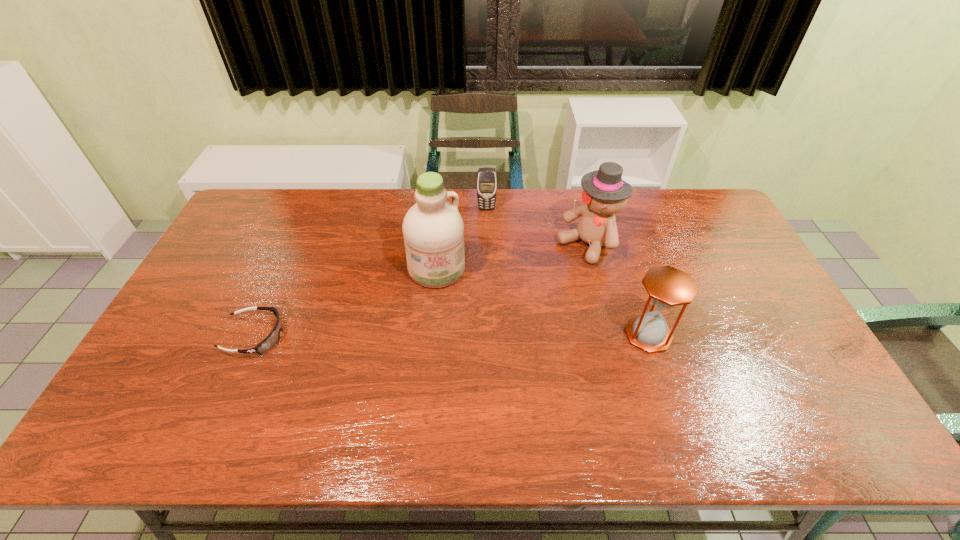
The height and width of the screenshot is (540, 960). In order to click on vacant region located 0.340m on the front face of the farthest object in this screenshot , I will do `click(490, 279)`.

The image size is (960, 540). I want to click on vacant area situated on the front face of the farthest object, so click(489, 255).

What are the coordinates of `vacant space located 0.060m on the front face of the farthest object` in the screenshot? It's located at (488, 222).

Find the location of `free space located on the front label of the tallest object`. free space located on the front label of the tallest object is located at coordinates point(450,314).

In order to click on vacant area located on the front label of the tallest object in this screenshot , I will do `click(473, 389)`.

The width and height of the screenshot is (960, 540). I want to click on free spot located 0.060m on the front label of the tallest object, so click(447, 303).

The image size is (960, 540). In order to click on vacant space situated 0.380m on the front-facing side of the fourth shortest object in this screenshot , I will do `click(484, 325)`.

Where is `vacant region located 0.230m on the front-facing side of the fourth shortest object`? The height and width of the screenshot is (540, 960). vacant region located 0.230m on the front-facing side of the fourth shortest object is located at coordinates (520, 297).

Where is `vacant position located on the front-facing side of the fourth shortest object`? Image resolution: width=960 pixels, height=540 pixels. vacant position located on the front-facing side of the fourth shortest object is located at coordinates (557, 269).

Image resolution: width=960 pixels, height=540 pixels. In order to click on cellular telephone present at the far edge in this screenshot , I will do `click(486, 177)`.